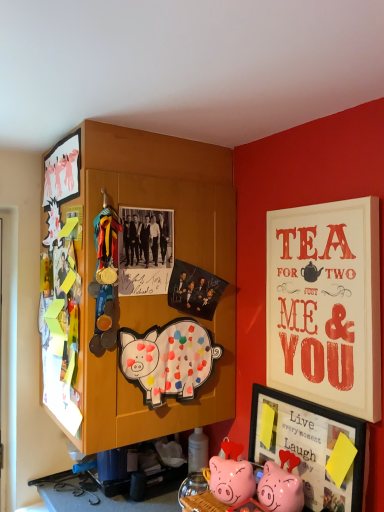
Question: Is matte white signboard at upper right, the 3th picture frame when ordered from left to right, thinner than painted paper pig at center?

Choices:
 (A) no
 (B) yes

Answer: (A)

Question: Would you consider matte white signboard at upper right, which is the 2th picture frame in top-to-bottom order, to be distant from painted paper pig at center?

Choices:
 (A) yes
 (B) no

Answer: (B)

Question: Is the depth of matte white signboard at upper right, which ranks as the first picture frame in right-to-left order, greater than that of painted paper pig at center?

Choices:
 (A) no
 (B) yes

Answer: (A)

Question: Considering the relative sizes of matte white signboard at upper right, which is the 2th picture frame in top-to-bottom order, and painted paper pig at center in the image provided, is matte white signboard at upper right, which is the 2th picture frame in top-to-bottom order, smaller than painted paper pig at center?

Choices:
 (A) no
 (B) yes

Answer: (A)

Question: From a real-world perspective, is matte white signboard at upper right, which is the 2th picture frame in top-to-bottom order, physically below painted paper pig at center?

Choices:
 (A) yes
 (B) no

Answer: (B)

Question: Looking at the image, does painted paper pig at center seem bigger or smaller compared to pink glossy piggy bank at lower center, which is counted as the second toy, starting from the left?

Choices:
 (A) small
 (B) big

Answer: (B)

Question: Do you think painted paper pig at center is within pink glossy piggy bank at lower center, which is counted as the second toy, starting from the left, or outside of it?

Choices:
 (A) inside
 (B) outside

Answer: (B)

Question: Is point (130, 375) closer or farther from the camera than point (291, 461)?

Choices:
 (A) farther
 (B) closer

Answer: (A)

Question: Considering the positions of painted paper pig at center and pink glossy piggy bank at lower center, which is counted as the second toy, starting from the left, in the image, is painted paper pig at center taller or shorter than pink glossy piggy bank at lower center, which is counted as the second toy, starting from the left,?

Choices:
 (A) short
 (B) tall

Answer: (B)

Question: Choose the correct answer: Is painted paper pig at center inside matte white picture frame at upper left, acting as the first picture frame starting from the top, or outside it?

Choices:
 (A) inside
 (B) outside

Answer: (B)

Question: Would you say painted paper pig at center is to the left or to the right of matte white picture frame at upper left, the first picture frame viewed from the left, in the picture?

Choices:
 (A) left
 (B) right

Answer: (B)

Question: Considering the positions of painted paper pig at center and matte white picture frame at upper left, the 3th picture frame positioned from the right, in the image, is painted paper pig at center wider or thinner than matte white picture frame at upper left, the 3th picture frame positioned from the right,?

Choices:
 (A) thin
 (B) wide

Answer: (B)

Question: From a real-world perspective, is painted paper pig at center positioned above or below matte white picture frame at upper left, acting as the first picture frame starting from the top?

Choices:
 (A) below
 (B) above

Answer: (A)

Question: In terms of size, does pink glossy piggy bank at lower center, which ranks as the first toy in right-to-left order, appear bigger or smaller than matte white signboard at upper right, the 3th picture frame when ordered from left to right?

Choices:
 (A) big
 (B) small

Answer: (B)

Question: Based on their positions, is pink glossy piggy bank at lower center, which is counted as the second toy, starting from the left, located to the left or right of matte white signboard at upper right, which is the 2th picture frame in top-to-bottom order?

Choices:
 (A) right
 (B) left

Answer: (B)